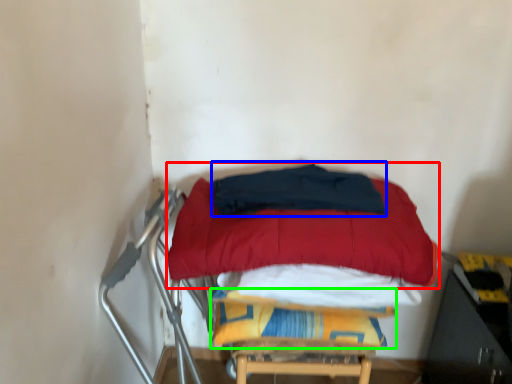
Question: Which is nearer to the mattress (highlighted by a red box)? blanket (highlighted by a blue box) or blanket (highlighted by a green box).

Choices:
 (A) blanket
 (B) blanket

Answer: (A)